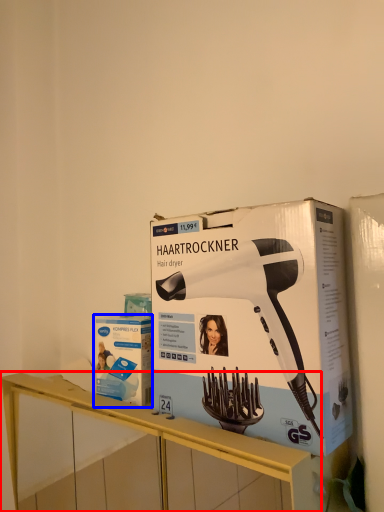
Question: Which object is further to the camera taking this photo, furniture (highlighted by a red box) or box (highlighted by a blue box)?

Choices:
 (A) furniture
 (B) box

Answer: (B)